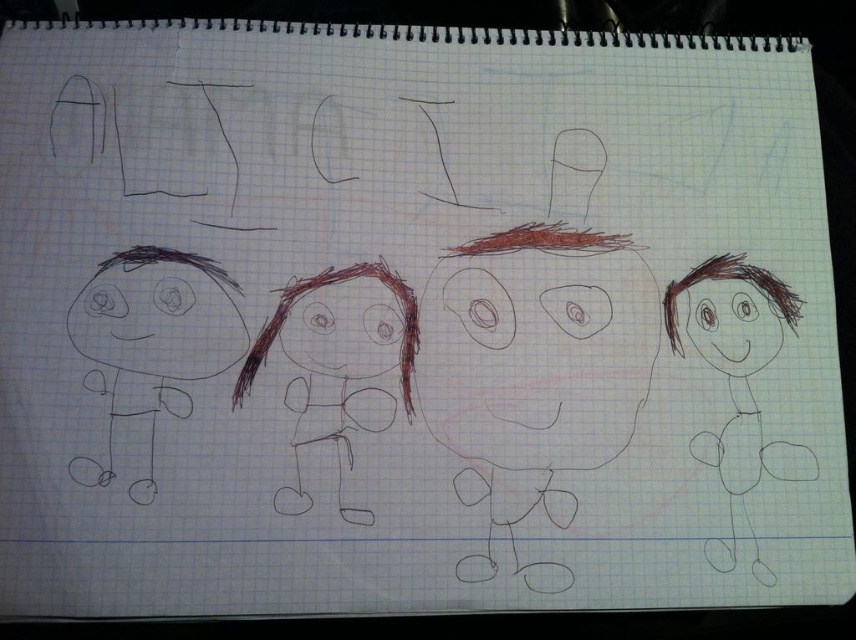
Question: Can you confirm if brown scribbled figure at left is positioned to the left of brown scribbled hair at center?

Choices:
 (A) no
 (B) yes

Answer: (B)

Question: Which of the following is the farthest from the observer?

Choices:
 (A) brown scribbled hair at center
 (B) brown sketchy stick figure at right
 (C) brown scribbled figure at left

Answer: (A)

Question: Is brown scribbled figure at left to the left of brown scribbled hair at center from the viewer's perspective?

Choices:
 (A) yes
 (B) no

Answer: (A)

Question: Which object is farther from the camera taking this photo?

Choices:
 (A) brown scribbled figure at left
 (B) brown sketchy stick figure at right

Answer: (B)

Question: Which object is closer to the camera taking this photo?

Choices:
 (A) brown scribbled figure at left
 (B) brown sketchy stick figure at right

Answer: (A)

Question: Observing the image, what is the correct spatial positioning of brown scribbled figure at left in reference to brown sketchy stick figure at right?

Choices:
 (A) right
 (B) left

Answer: (B)